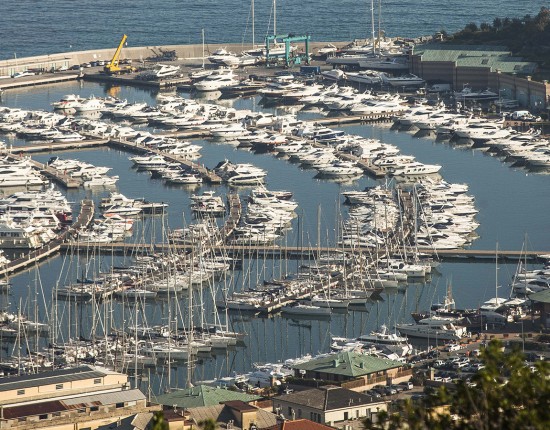
The height and width of the screenshot is (430, 550). I want to click on wall, so click(86, 56), click(217, 49), click(10, 73).